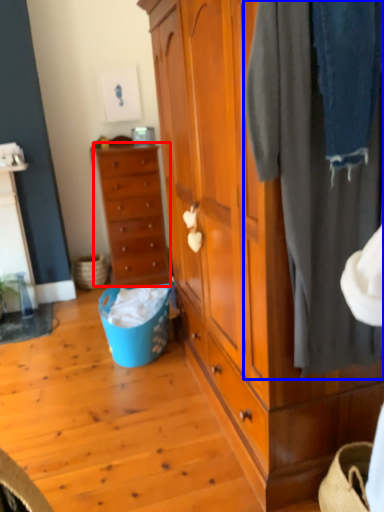
Question: Which of the following is the farthest to the observer, chest of drawers (highlighted by a red box) or clothing (highlighted by a blue box)?

Choices:
 (A) chest of drawers
 (B) clothing

Answer: (A)